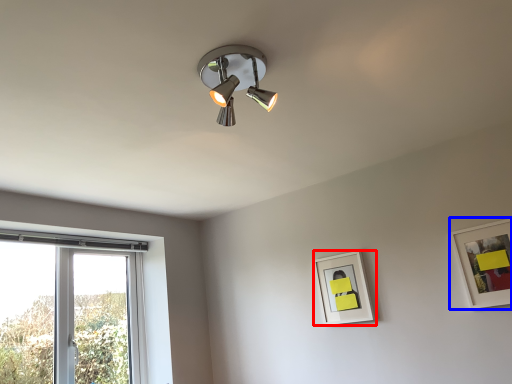
Question: Which point is closer to the camera, picture frame (highlighted by a red box) or picture frame (highlighted by a blue box)?

Choices:
 (A) picture frame
 (B) picture frame

Answer: (B)